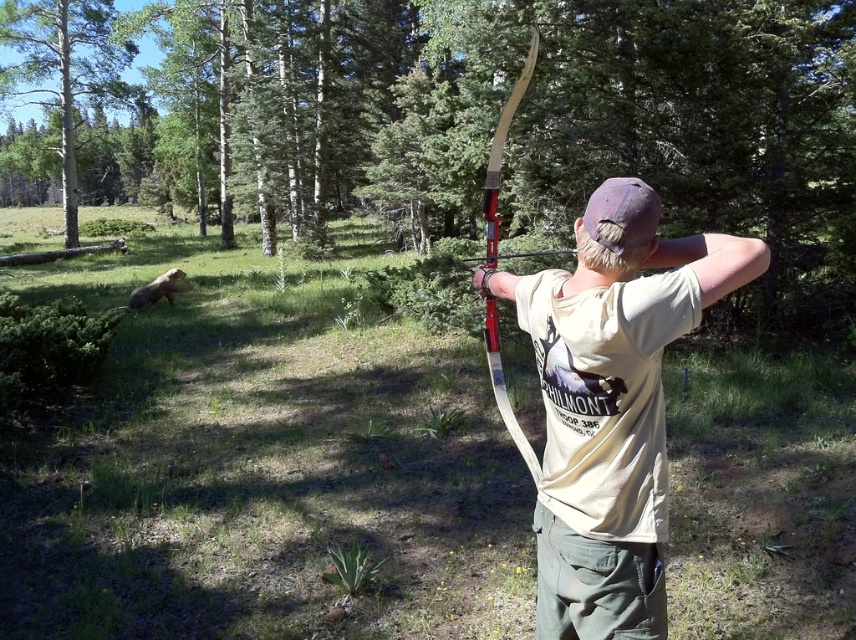
You are an archer standing at the point labeled as point (638, 387). You want to shoot an arrow towards the target located at point (691, 104). However, there is a large tree trunk blocking your direct path. Can you adjust your shot to hit the target by aiming around the obstacle?

Point (691, 104) is behind point (638, 387), so the target is located behind your current position. This means you cannot shoot towards it as it is behind you. You should reposition yourself or check the target placement.

You are an archer preparing to shoot an arrow. You notice a green leafy tree at left in your line of sight. Based on its position, can you estimate how far to the left it is from the center of the image?

The green leafy tree at left is located at point 0.109 on the horizontal axis, meaning it is approximately 10.9 percent from the left edge of the image, placing it relatively close to the left side.